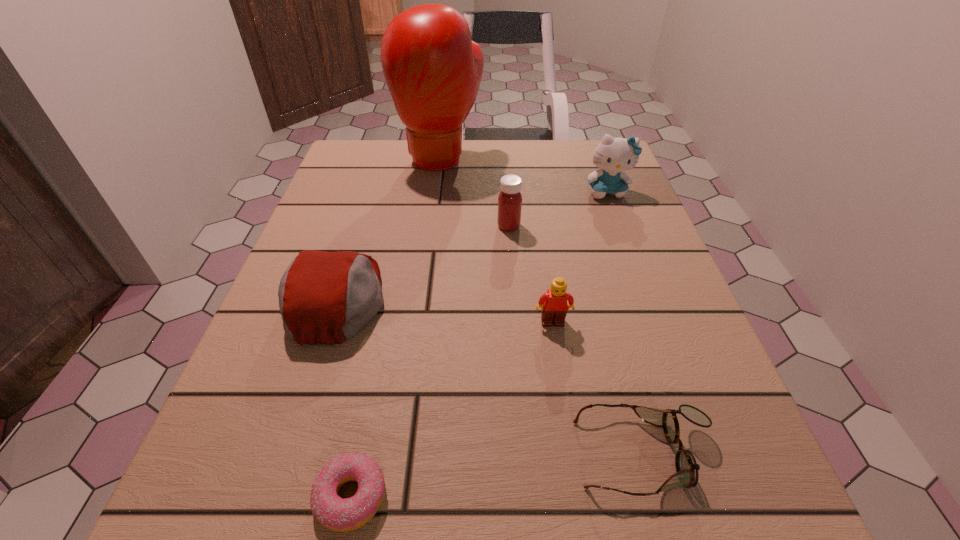
Image resolution: width=960 pixels, height=540 pixels. I want to click on free space that is in between the doughnut and the Lego, so (x=452, y=409).

Image resolution: width=960 pixels, height=540 pixels. In order to click on empty space that is in between the tallest object and the kitten in this screenshot , I will do `click(524, 175)`.

Where is `free space between the second farthest object and the medicine`? free space between the second farthest object and the medicine is located at coordinates (558, 209).

Locate an element on the screen. The height and width of the screenshot is (540, 960). vacant area that lies between the farthest object and the third farthest object is located at coordinates (474, 192).

You are a GUI agent. You are given a task and a screenshot of the screen. Output one action in this format:
    pyautogui.click(x=<x>, y=<y>)
    Task: Click on the vacant area between the Lego and the shortest object
    This screenshot has width=960, height=540.
    Given the screenshot: What is the action you would take?
    pyautogui.click(x=452, y=409)

Identify the location of free space between the fifth nearest object and the farthest object. (474, 192).

Find the location of a particular element. Image resolution: width=960 pixels, height=540 pixels. empty location between the boxing glove and the fourth object from right to left is located at coordinates [x=474, y=192].

Locate an element on the screen. vacant space that is in between the Lego and the farthest object is located at coordinates (496, 240).

Select which object appears as the sixth closest to the third farthest object. Please provide its 2D coordinates. Your answer should be formatted as a tuple, i.e. [(x, y)], where the tuple contains the x and y coordinates of a point satisfying the conditions above.

[(337, 514)]

Identify which object is the nearest to the tallest object. Please provide its 2D coordinates. Your answer should be formatted as a tuple, i.e. [(x, y)], where the tuple contains the x and y coordinates of a point satisfying the conditions above.

[(510, 199)]